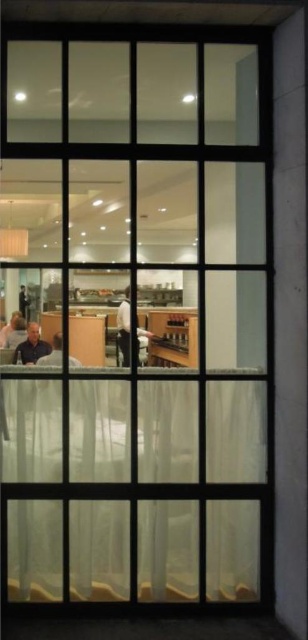
Question: Among these points, which one is nearest to the camera?

Choices:
 (A) (28, 362)
 (B) (145, 337)

Answer: (A)

Question: Is translucent fabric curtain at lower center below matte black laptop at lower left?

Choices:
 (A) yes
 (B) no

Answer: (A)

Question: In this image, where is translucent fabric curtain at lower center located relative to matte black laptop at lower left?

Choices:
 (A) right
 (B) left

Answer: (A)

Question: Which point is closer to the camera?

Choices:
 (A) (158, 422)
 (B) (76, 362)
 (C) (122, 332)
 (D) (24, 346)

Answer: (D)

Question: Can you confirm if dark gray fabric jacket at center is wider than matte black shirt at lower left?

Choices:
 (A) no
 (B) yes

Answer: (B)

Question: Which object is the farthest from the translucent fabric curtain at lower center?

Choices:
 (A) dark gray fabric jacket at center
 (B) matte black shirt at lower left

Answer: (B)